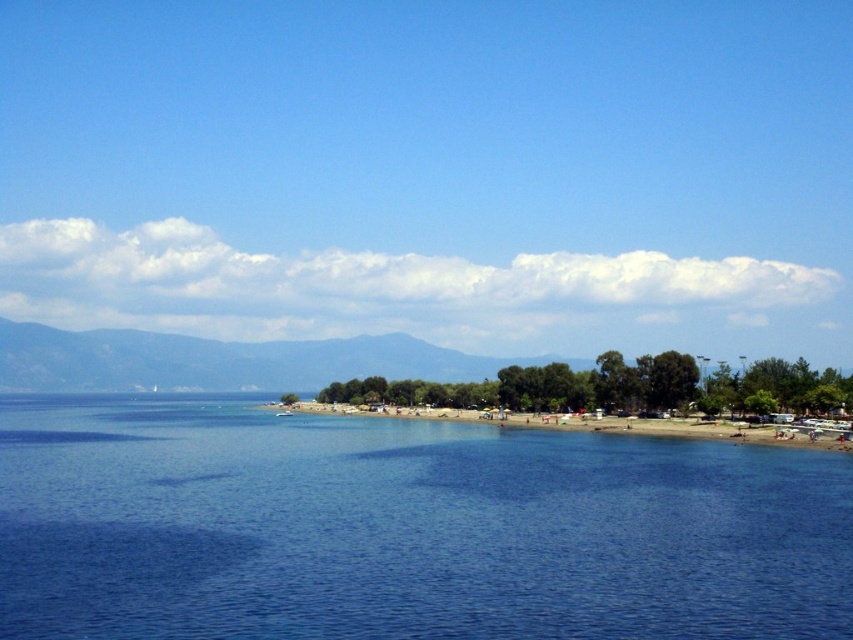
Who is lower down, blue water at center or green leafy mountain at center?

green leafy mountain at center

Does blue water at center have a lesser width compared to green leafy mountain at center?

Yes, blue water at center is thinner than green leafy mountain at center.

Does point (387, 552) come behind point (120, 356)?

No.

The width and height of the screenshot is (853, 640). What are the coordinates of `blue water at center` in the screenshot? It's located at (404, 529).